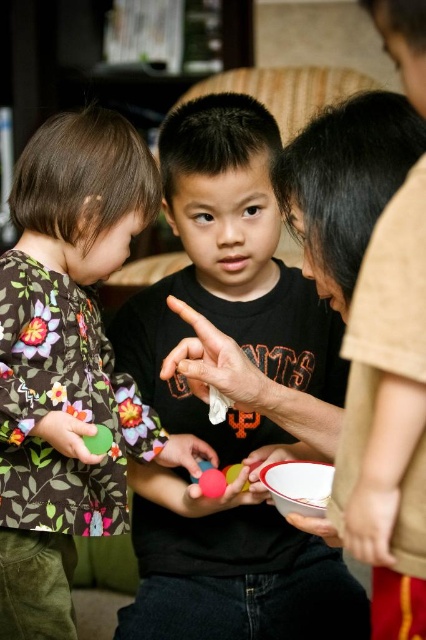
You are standing in the living room and see two points marked in the image. Which point is closer to you, point [172,440] or point [201,477]?

Point [172,440] is closer to you than point [201,477].

You are a photographer trying to capture the white matte hand at center in the image. Where exactly should you focus your camera to ensure the hand is in the center of the photo?

You should focus your camera at point coordinates (x=215, y=364) to ensure the white matte hand at center is captured in the center of the photo.

You are a parent trying to ensure the children are playing safely. The safety guidelines state that children should be at least 3 feet apart to prevent accidents. Are the two children holding the matte plastic toy at center within the required distance?

The children are 36.76 inches apart, which is equivalent to 3.06 feet. Since the required distance is at least 3 feet, they are just within the safety guidelines.